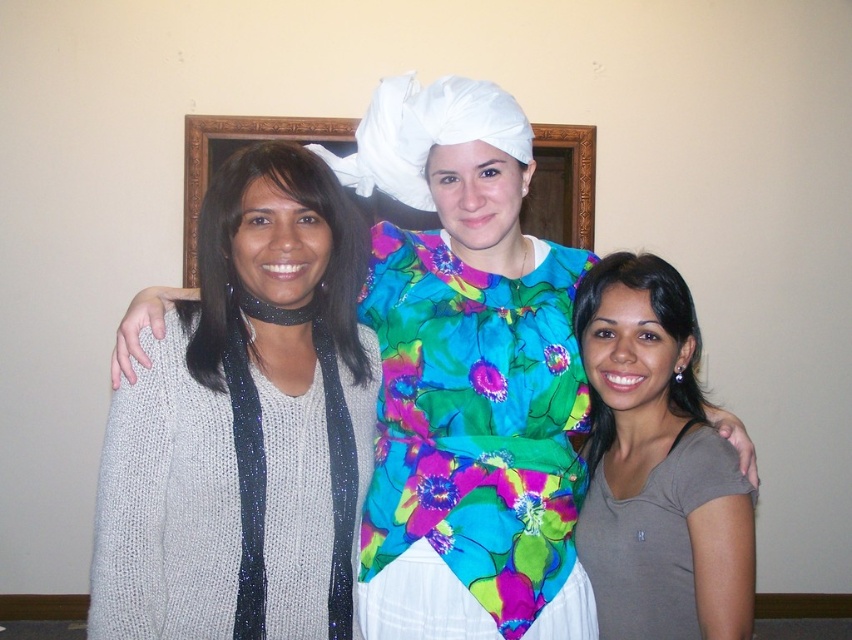
Question: Among these points, which one is farthest from the camera?

Choices:
 (A) (347, 120)
 (B) (573, 577)
 (C) (134, 516)

Answer: (A)

Question: Is floral print fabric dress at center to the right of white fabric at center from the viewer's perspective?

Choices:
 (A) no
 (B) yes

Answer: (A)

Question: Is white satin turban at center to the right of gray matte shirt at center from the viewer's perspective?

Choices:
 (A) no
 (B) yes

Answer: (A)

Question: Is white satin turban at center smaller than white fabric at center?

Choices:
 (A) yes
 (B) no

Answer: (B)

Question: Which object is closer to the camera taking this photo?

Choices:
 (A) floral print fabric dress at center
 (B) white fabric at center
 (C) white knit dress at left

Answer: (C)

Question: Which point is farther from the camera taking this photo?

Choices:
 (A) (728, 605)
 (B) (559, 198)

Answer: (B)